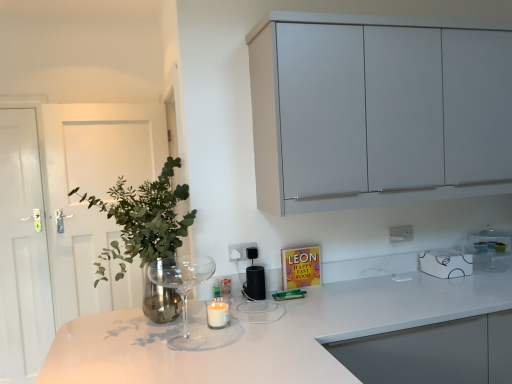
Question: Do you think white glossy coffee cup at upper right, positioned as the 2th appliance in left-to-right order, is within white glossy microwave at upper right, acting as the third appliance starting from the left, or outside of it?

Choices:
 (A) outside
 (B) inside

Answer: (A)

Question: From the image's perspective, relative to white glossy microwave at upper right, acting as the third appliance starting from the left, is white glossy coffee cup at upper right, positioned as the 2th appliance in left-to-right order, above or below?

Choices:
 (A) below
 (B) above

Answer: (A)

Question: Estimate the real-world distances between objects in this image. Which object is farther from the black matte speaker at center, arranged as the first appliance when viewed from the left?

Choices:
 (A) transparent glass wine glass at lower left
 (B) white glossy door at left
 (C) white glossy coffee cup at upper right, positioned as the second appliance in right-to-left order
 (D) white glossy microwave at upper right, which ranks as the first appliance in right-to-left order
 (E) matte gray cabinet at upper right

Answer: (B)

Question: Which object is positioned farthest from the white plastic electric outlet at upper center, which appears as the 1th electric outlet when viewed from the right?

Choices:
 (A) white glossy microwave at upper right, acting as the third appliance starting from the left
 (B) white wooden door at left
 (C) white glossy countertop at center
 (D) transparent glass wine glass at lower left
 (E) white glossy coffee cup at upper right, positioned as the 2th appliance in left-to-right order

Answer: (B)